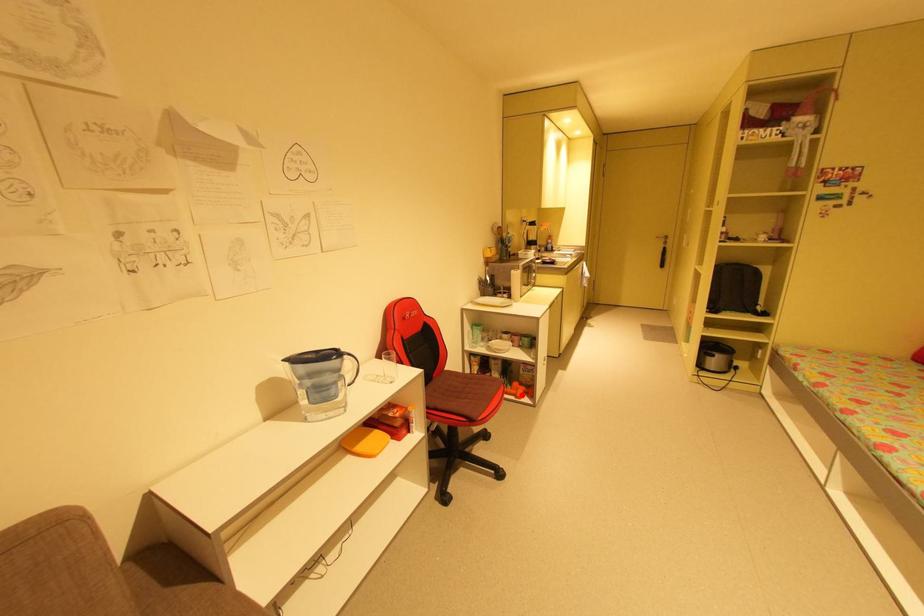
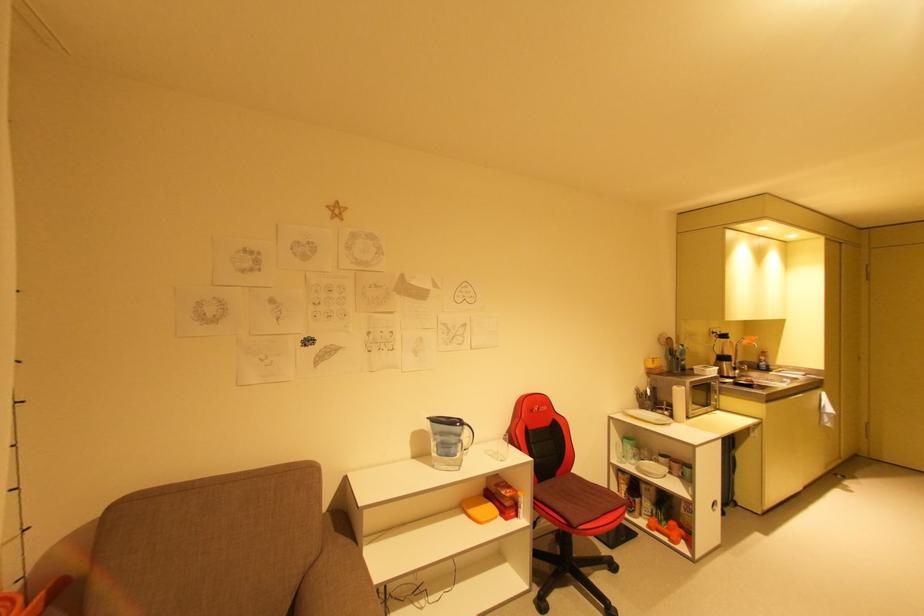
Question: I am providing you with two images of the same scene from different viewpoints. Given a red point in image1, look at the same physical point in image2. Is it:

Choices:
 (A) Closer to the viewpoint
 (B) Farther from the viewpoint

Answer: (B)